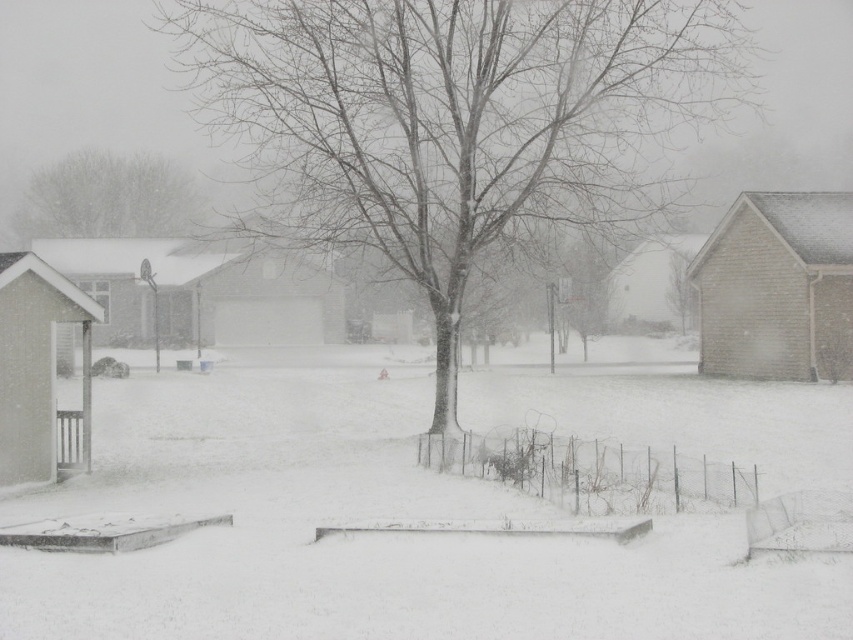
Can you confirm if bare branches at upper left is wider than white matte house at center?

Yes.

Is bare branches at upper left further to camera compared to white matte house at center?

Yes, it is behind white matte house at center.

Is point (128, 208) in front of point (643, 314)?

No, (128, 208) is further to viewer.

Find the location of `bare branches at upper left`. bare branches at upper left is located at coordinates [108, 198].

Measure the distance between brown wood shed at lower left and bare branches at upper left.

A distance of 54.01 meters exists between brown wood shed at lower left and bare branches at upper left.

Does brown wood shed at lower left lie behind bare branches at upper left?

No, it is in front of bare branches at upper left.

What do you see at coordinates (38, 365) in the screenshot? This screenshot has width=853, height=640. I see `brown wood shed at lower left` at bounding box center [38, 365].

The image size is (853, 640). I want to click on brown wood shed at lower left, so click(38, 365).

Between white fluffy snow at center and brick house at right, which one appears on the right side from the viewer's perspective?

From the viewer's perspective, brick house at right appears more on the right side.

Is white fluffy snow at center further to the viewer compared to brick house at right?

No.

Does point (345, 435) come behind point (831, 378)?

No, it is not.

At what (x,y) coordinates should I click in order to perform the action: click on white fluffy snow at center. Please return your answer as a coordinate pair (x, y). Looking at the image, I should click on (419, 509).